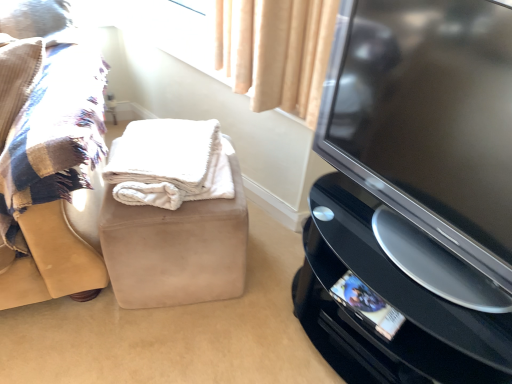
Question: From the image's perspective, is plaid fabric cushion at left, arranged as the first furniture when viewed from the left, over black glossy tv at right?

Choices:
 (A) yes
 (B) no

Answer: (A)

Question: Is black glossy tv at right inside plaid fabric cushion at left, arranged as the first furniture when viewed from the left?

Choices:
 (A) yes
 (B) no

Answer: (B)

Question: Could you tell me if plaid fabric cushion at left, which ranks as the second furniture in right-to-left order, is facing black glossy tv at right?

Choices:
 (A) yes
 (B) no

Answer: (B)

Question: From a real-world perspective, is plaid fabric cushion at left, which ranks as the second furniture in right-to-left order, located higher than black glossy tv at right?

Choices:
 (A) yes
 (B) no

Answer: (A)

Question: Can you confirm if plaid fabric cushion at left, which ranks as the second furniture in right-to-left order, is shorter than black glossy tv at right?

Choices:
 (A) no
 (B) yes

Answer: (A)

Question: From the image's perspective, does plaid fabric cushion at left, which ranks as the second furniture in right-to-left order, appear lower than black glossy tv at right?

Choices:
 (A) no
 (B) yes

Answer: (A)

Question: From the image's perspective, is beige suede ottoman at center, positioned as the second furniture in left-to-right order, located above plaid fabric cushion at left, which ranks as the second furniture in right-to-left order?

Choices:
 (A) no
 (B) yes

Answer: (A)

Question: Is beige suede ottoman at center, positioned as the second furniture in left-to-right order, behind plaid fabric cushion at left, arranged as the first furniture when viewed from the left?

Choices:
 (A) no
 (B) yes

Answer: (B)

Question: Could you tell me if beige suede ottoman at center, which ranks as the 1th furniture in right-to-left order, is turned towards plaid fabric cushion at left, arranged as the first furniture when viewed from the left?

Choices:
 (A) yes
 (B) no

Answer: (B)

Question: Is beige suede ottoman at center, positioned as the second furniture in left-to-right order, to the left of plaid fabric cushion at left, arranged as the first furniture when viewed from the left, from the viewer's perspective?

Choices:
 (A) no
 (B) yes

Answer: (A)

Question: Is beige suede ottoman at center, positioned as the second furniture in left-to-right order, not near plaid fabric cushion at left, arranged as the first furniture when viewed from the left?

Choices:
 (A) no
 (B) yes

Answer: (A)

Question: Is the position of beige suede ottoman at center, which ranks as the 1th furniture in right-to-left order, less distant than that of plaid fabric cushion at left, arranged as the first furniture when viewed from the left?

Choices:
 (A) yes
 (B) no

Answer: (B)

Question: From the image's perspective, is black glossy tv at right under beige suede ottoman at center, positioned as the second furniture in left-to-right order?

Choices:
 (A) no
 (B) yes

Answer: (A)